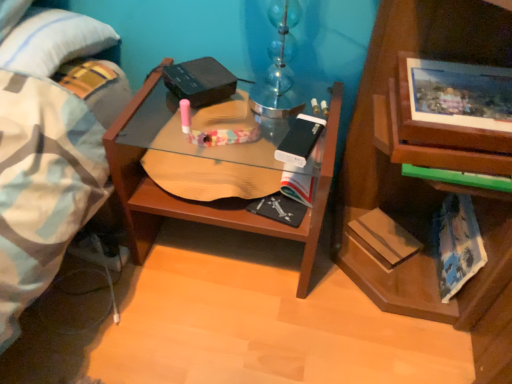
Where is `vacant space in front of blue tie-dye paperback book at lower right, which appears as the 1th paperback book when viewed from the right`? vacant space in front of blue tie-dye paperback book at lower right, which appears as the 1th paperback book when viewed from the right is located at coordinates (426, 336).